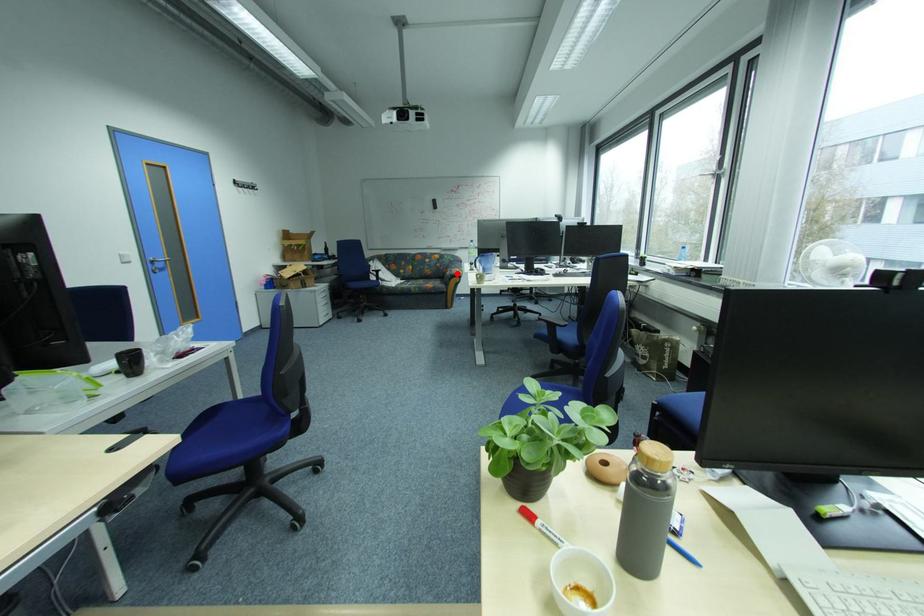
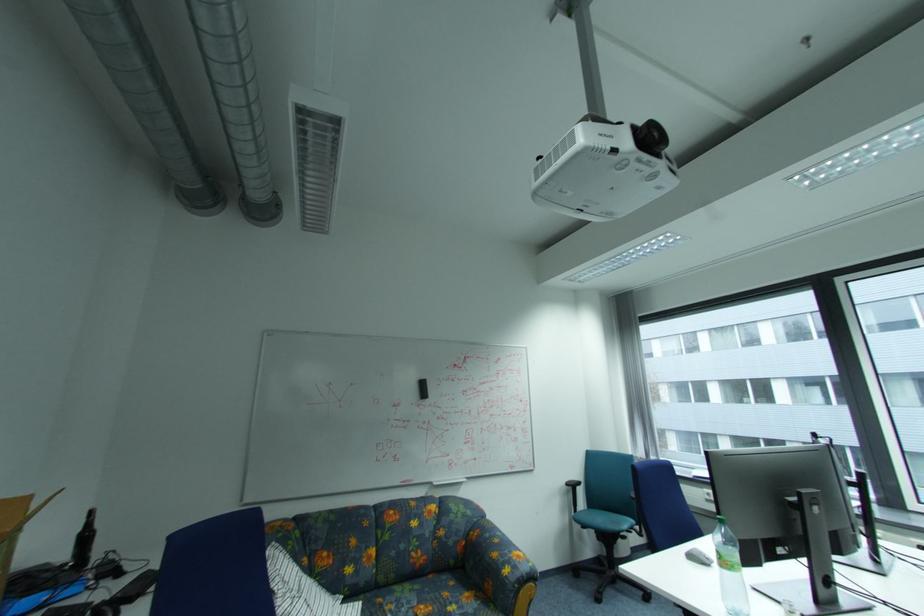
Question: I am providing you with two images of the same scene from different viewpoints. In image1, a red point is highlighted. Considering the same 3D point in image2, which of the following is correct?

Choices:
 (A) It is closer
 (B) It is farther

Answer: (B)